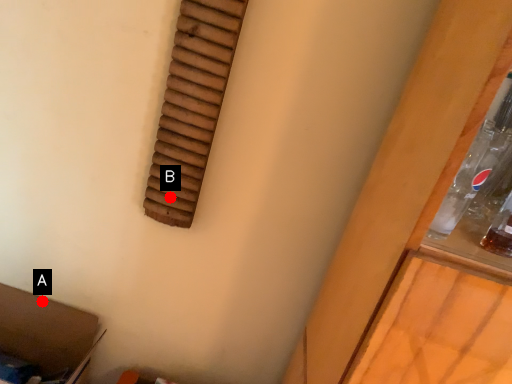
Question: Two points are circled on the image, labeled by A and B beside each circle. Which point is closer to the camera?

Choices:
 (A) A is closer
 (B) B is closer

Answer: (B)